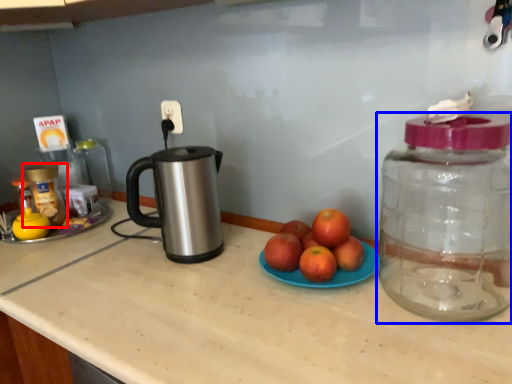
Question: Which object appears closest to the camera in this image, bottle (highlighted by a red box) or bottle (highlighted by a blue box)?

Choices:
 (A) bottle
 (B) bottle

Answer: (B)